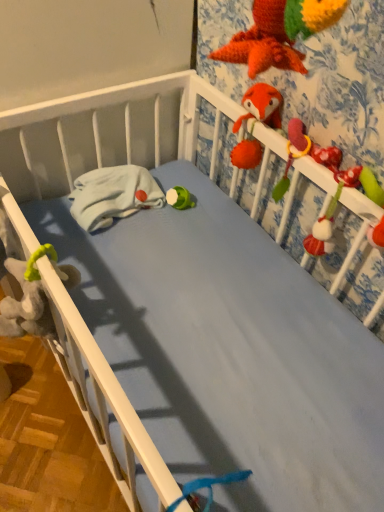
Question: Is there a large distance between fluffy orange fox at upper right, placed as the 2th toy when sorted from right to left, and soft plush toy at right, the 2th toy when ordered from top to bottom?

Choices:
 (A) no
 (B) yes

Answer: (A)

Question: Does fluffy orange fox at upper right, the 1th toy viewed from the left, have a larger size compared to soft plush toy at right, which is the first toy in right-to-left order?

Choices:
 (A) no
 (B) yes

Answer: (A)

Question: Are fluffy orange fox at upper right, positioned as the 2th toy in bottom-to-top order, and soft plush toy at right, the second toy viewed from the left, making contact?

Choices:
 (A) yes
 (B) no

Answer: (B)

Question: Can you confirm if fluffy orange fox at upper right, positioned as the 2th toy in bottom-to-top order, is positioned to the left of soft plush toy at right, which is the first toy in right-to-left order?

Choices:
 (A) yes
 (B) no

Answer: (A)

Question: From the image's perspective, would you say fluffy orange fox at upper right, positioned as the 2th toy in bottom-to-top order, is positioned over soft plush toy at right, the 2th toy when ordered from top to bottom?

Choices:
 (A) yes
 (B) no

Answer: (A)

Question: In the image, is fuzzy red parrot at upper right positioned in front of or behind fluffy orange fox at upper right, positioned as the 2th toy in bottom-to-top order?

Choices:
 (A) front
 (B) behind

Answer: (A)

Question: Is point (291, 126) closer or farther from the camera than point (253, 165)?

Choices:
 (A) farther
 (B) closer

Answer: (B)

Question: Considering the positions of fuzzy red parrot at upper right and fluffy orange fox at upper right, which appears as the 1th toy when viewed from the top, in the image, is fuzzy red parrot at upper right taller or shorter than fluffy orange fox at upper right, which appears as the 1th toy when viewed from the top,?

Choices:
 (A) short
 (B) tall

Answer: (A)

Question: Would you say fuzzy red parrot at upper right is inside or outside fluffy orange fox at upper right, placed as the 2th toy when sorted from right to left?

Choices:
 (A) inside
 (B) outside

Answer: (B)

Question: Looking at their shapes, would you say fluffy orange fox at upper right, the 1th toy viewed from the left, is wider or thinner than white matte crib rail at center?

Choices:
 (A) wide
 (B) thin

Answer: (B)

Question: Considering the positions of point (241, 162) and point (84, 390), is point (241, 162) closer or farther from the camera than point (84, 390)?

Choices:
 (A) farther
 (B) closer

Answer: (A)

Question: Considering the positions of fluffy orange fox at upper right, placed as the 2th toy when sorted from right to left, and white matte crib rail at center in the image, is fluffy orange fox at upper right, placed as the 2th toy when sorted from right to left, bigger or smaller than white matte crib rail at center?

Choices:
 (A) small
 (B) big

Answer: (A)

Question: Visually, is fluffy orange fox at upper right, positioned as the 2th toy in bottom-to-top order, positioned to the left or to the right of white matte crib rail at center?

Choices:
 (A) right
 (B) left

Answer: (A)

Question: Is point (299, 155) closer or farther from the camera than point (18, 214)?

Choices:
 (A) closer
 (B) farther

Answer: (B)

Question: Considering the positions of fuzzy red parrot at upper right and white matte crib rail at center in the image, is fuzzy red parrot at upper right wider or thinner than white matte crib rail at center?

Choices:
 (A) wide
 (B) thin

Answer: (B)